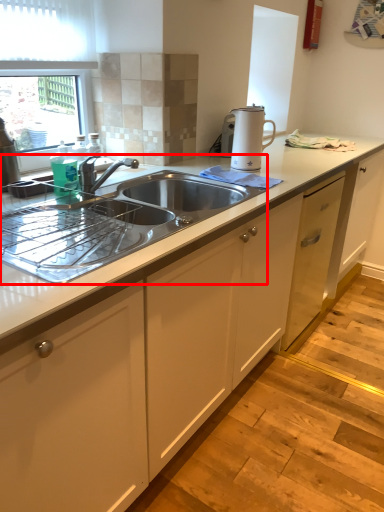
Question: Where is sink (annotated by the red box) located in relation to home appliance in the image?

Choices:
 (A) left
 (B) right

Answer: (A)